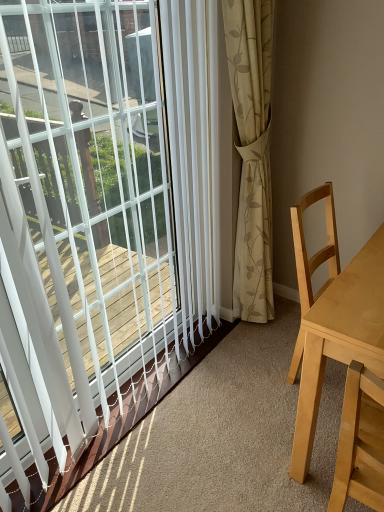
In order to click on free space that is to the left of light wood table at right in this screenshot , I will do `click(226, 424)`.